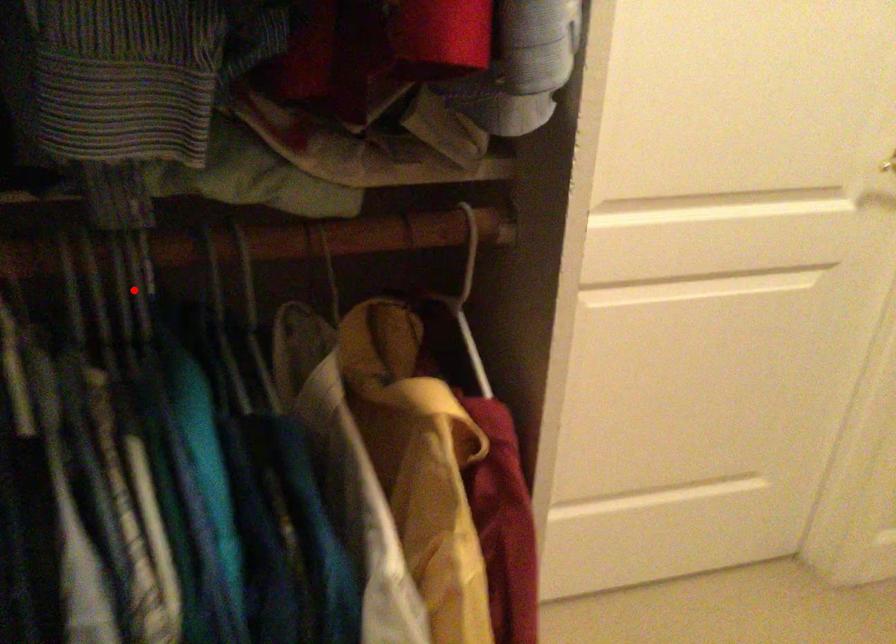
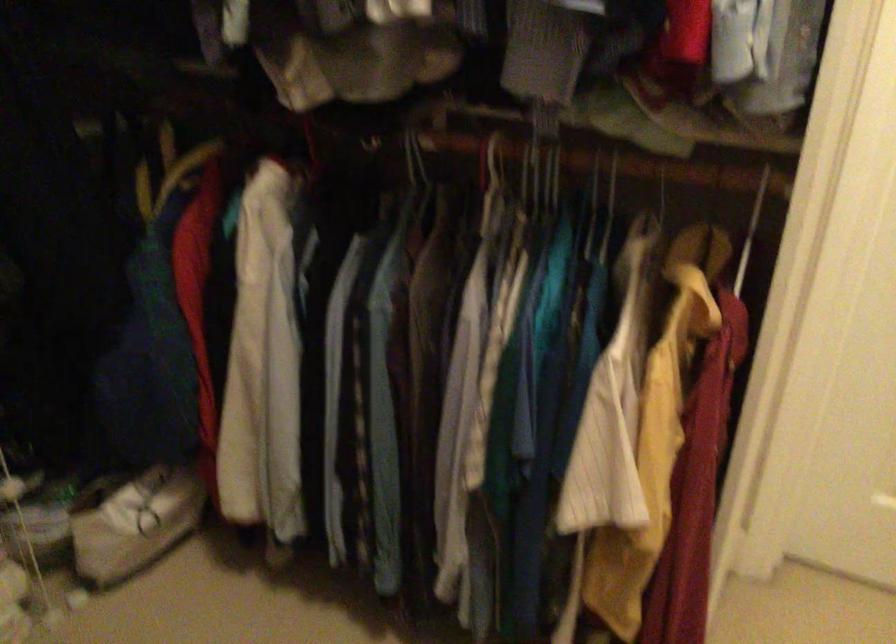
Question: I am providing you with two images of the same scene from different viewpoints. Given a red point in image1, look at the same physical point in image2. Is it:

Choices:
 (A) Closer to the viewpoint
 (B) Farther from the viewpoint

Answer: (B)